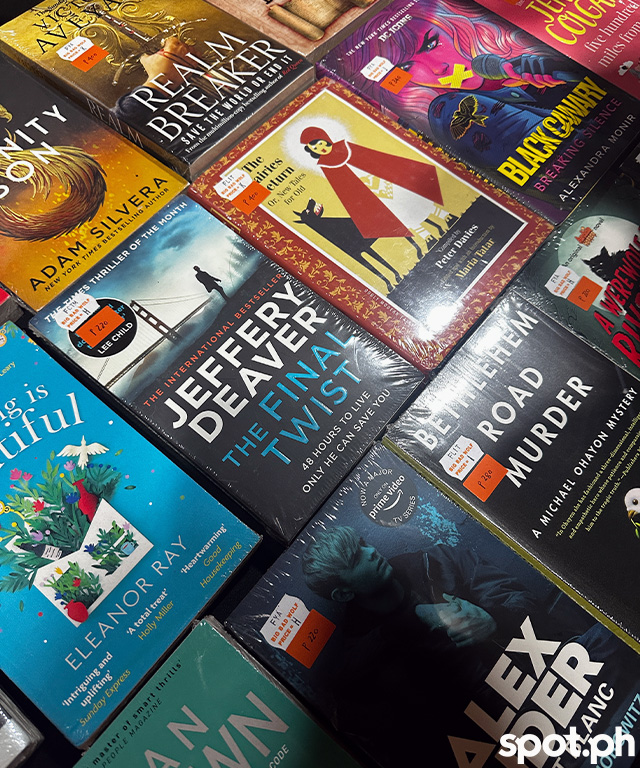
Where is `book`? This screenshot has height=768, width=640. book is located at coordinates (201, 670).